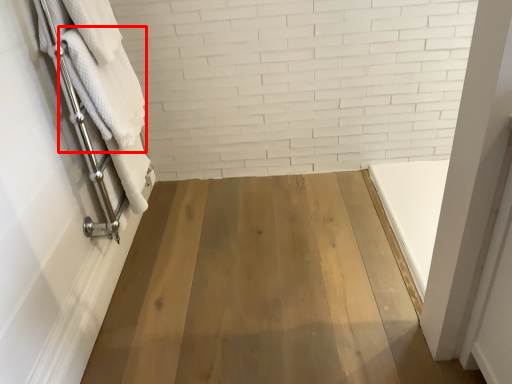
Question: In this image, where is bath towel (annotated by the red box) located relative to bath towel?

Choices:
 (A) left
 (B) right

Answer: (B)